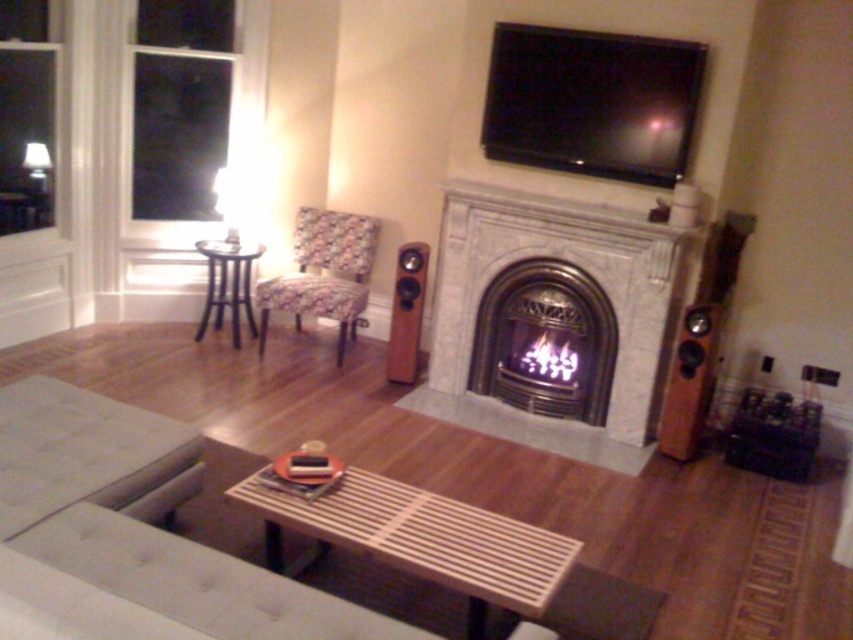
Question: Considering the relative positions of polished brass fireplace at center and floral fabric chair at center in the image provided, where is polished brass fireplace at center located with respect to floral fabric chair at center?

Choices:
 (A) above
 (B) below

Answer: (B)

Question: Is floral fabric chair at center in front of brown wood speaker at right?

Choices:
 (A) yes
 (B) no

Answer: (B)

Question: Which is farther from the brown wood speaker at right?

Choices:
 (A) white fabric ottoman at lower left
 (B) wooden speaker at center
 (C) white marble fireplace at center

Answer: (A)

Question: Is white marble fireplace at center to the right of polished brass fireplace at center from the viewer's perspective?

Choices:
 (A) no
 (B) yes

Answer: (B)

Question: Among these points, which one is nearest to the camera?

Choices:
 (A) (546, 205)
 (B) (99, 492)
 (C) (283, 285)

Answer: (B)

Question: Considering the real-world distances, which object is closest to the wooden speaker at center?

Choices:
 (A) floral fabric chair at center
 (B) white marble fireplace at center
 (C) polished brass fireplace at center

Answer: (B)